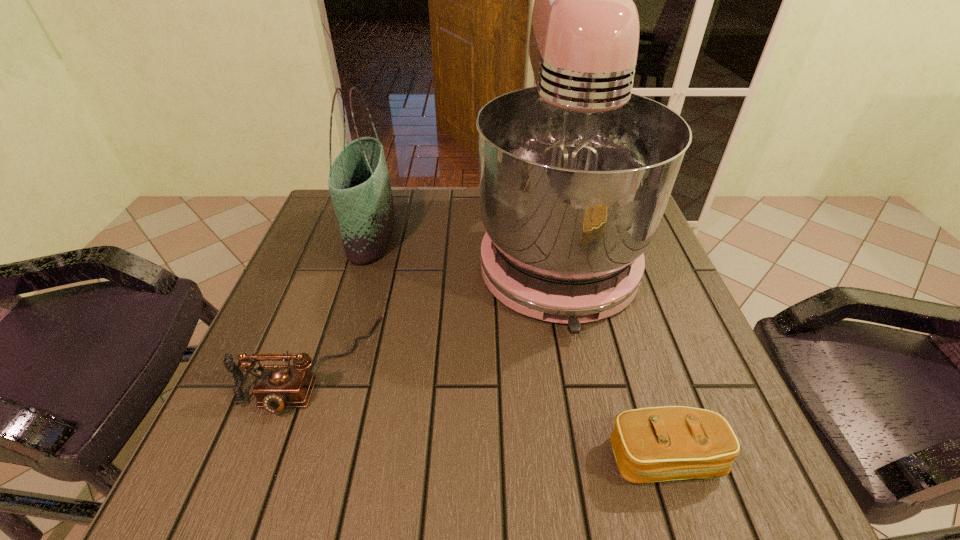
Where is `object present at the near edge`? The width and height of the screenshot is (960, 540). object present at the near edge is located at coordinates (654, 444).

What are the coordinates of `tote bag at the left edge` in the screenshot? It's located at (359, 183).

Where is `telephone that is at the left edge`? telephone that is at the left edge is located at coordinates (277, 386).

Locate an element on the screen. The width and height of the screenshot is (960, 540). mixer that is at the right edge is located at coordinates (575, 173).

Locate an element on the screen. This screenshot has width=960, height=540. clutch bag that is at the right edge is located at coordinates (654, 444).

Where is `object located at the far left corner`? This screenshot has width=960, height=540. object located at the far left corner is located at coordinates (359, 183).

Locate an element on the screen. This screenshot has height=540, width=960. object at the far right corner is located at coordinates (575, 173).

In order to click on object present at the near right corner in this screenshot , I will do `click(654, 444)`.

Locate an element on the screen. vacant space at the far edge is located at coordinates (474, 190).

You are a GUI agent. You are given a task and a screenshot of the screen. Output one action in this format:
    pyautogui.click(x=<x>, y=<y>)
    Task: Click on the free space at the near edge
    The width and height of the screenshot is (960, 540).
    Given the screenshot: What is the action you would take?
    pyautogui.click(x=369, y=440)